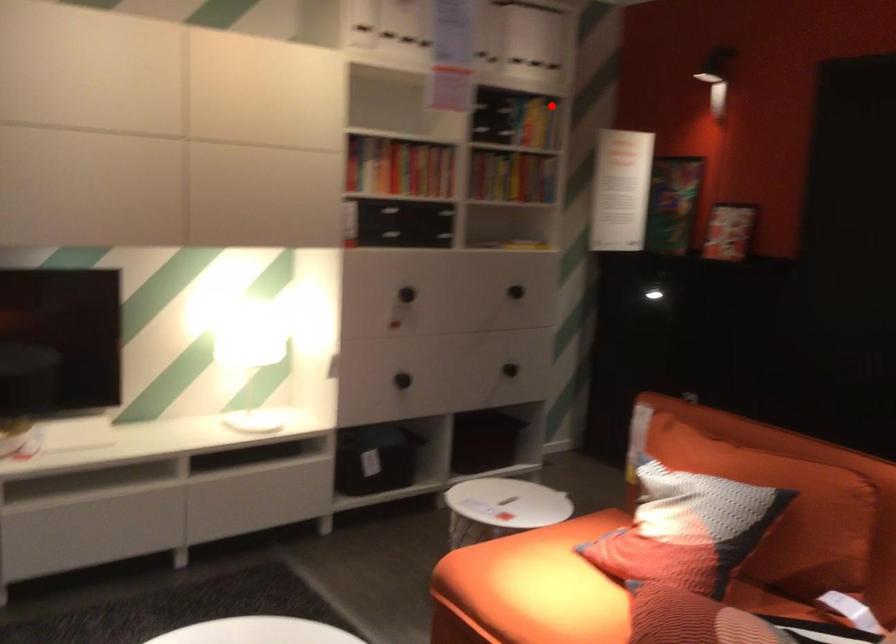
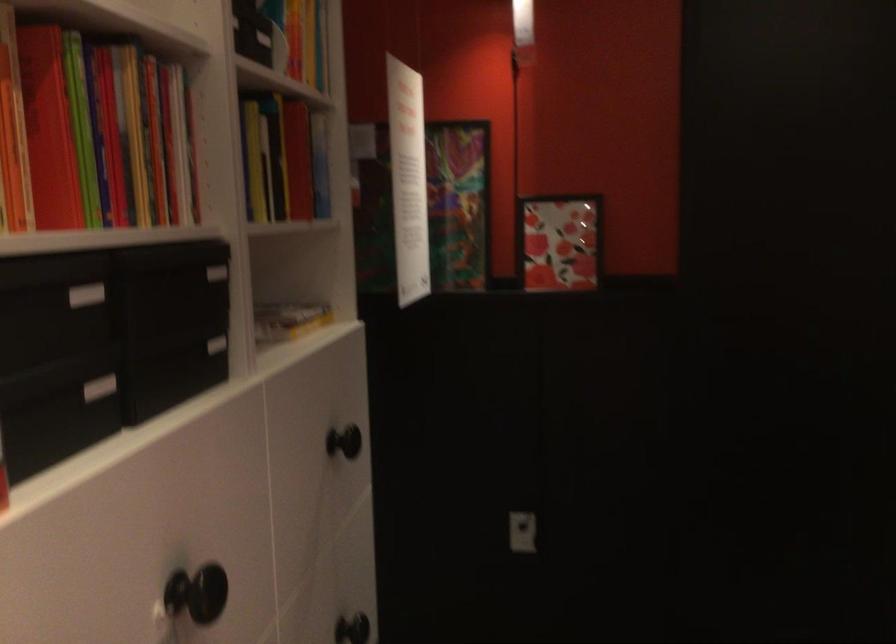
Find the pixel in the second image that matches the highlighted location in the first image.

(309, 49)